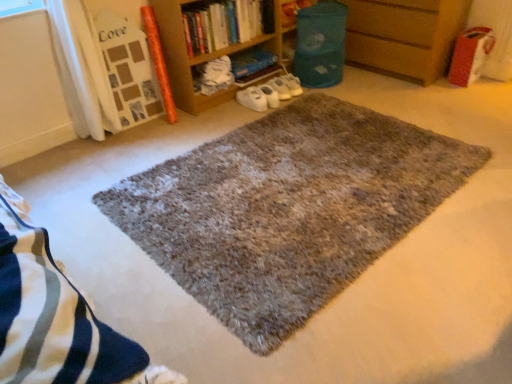
Question: Is point (424, 54) closer or farther from the camera than point (256, 18)?

Choices:
 (A) closer
 (B) farther

Answer: (A)

Question: Is wooden at right inside or outside of hardcover book at upper center, the second book from the back?

Choices:
 (A) inside
 (B) outside

Answer: (B)

Question: Estimate the real-world distances between objects in this image. Which object is closer to the hardcover book at upper center, which ranks as the 1th book in front-to-back order?

Choices:
 (A) hardcover book at center, marked as the second book in a front-to-back arrangement
 (B) shaggy gray rug at center
 (C) white matte shoes at center
 (D) wooden at right
 (E) brown wooden bookcase at upper center

Answer: (E)

Question: Which object is the closest to the wooden at right?

Choices:
 (A) hardcover book at center, the 1th book in the back-to-front sequence
 (B) hardcover book at upper center, which ranks as the 1th book in front-to-back order
 (C) white matte shoes at center
 (D) brown wooden bookcase at upper center
 (E) shaggy gray rug at center

Answer: (C)